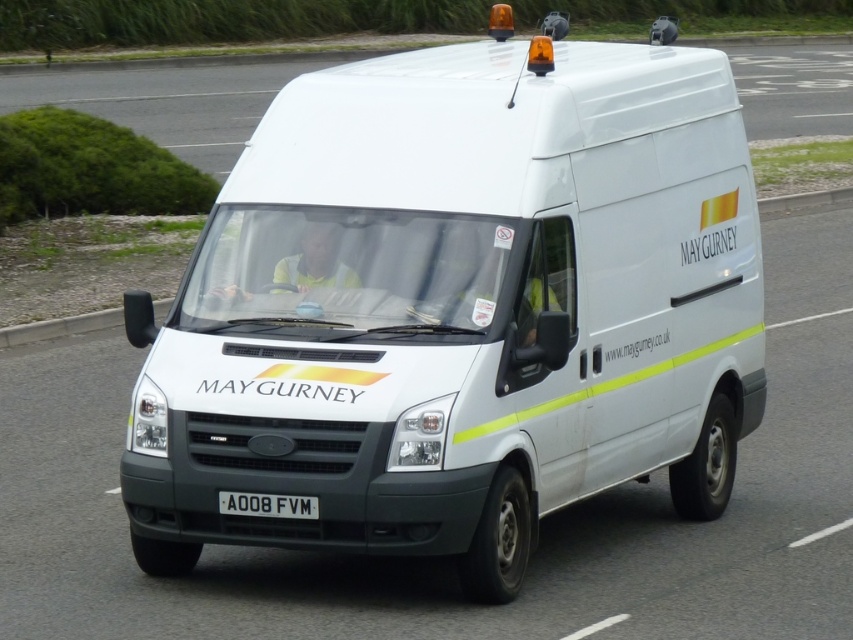
You are a traffic officer observing two vans on the road. You notice a white matte van at center and a white glossy van at center. Which van is larger in size?

The white glossy van at center is larger in size compared to the white matte van at center.

You are a pedestrian standing on the sidewalk. You notice the white matte van at center and the black plastic license plate at center. Which object is higher up from the ground?

The white matte van at center is taller than the black plastic license plate at center, so the white matte van at center is higher up from the ground.